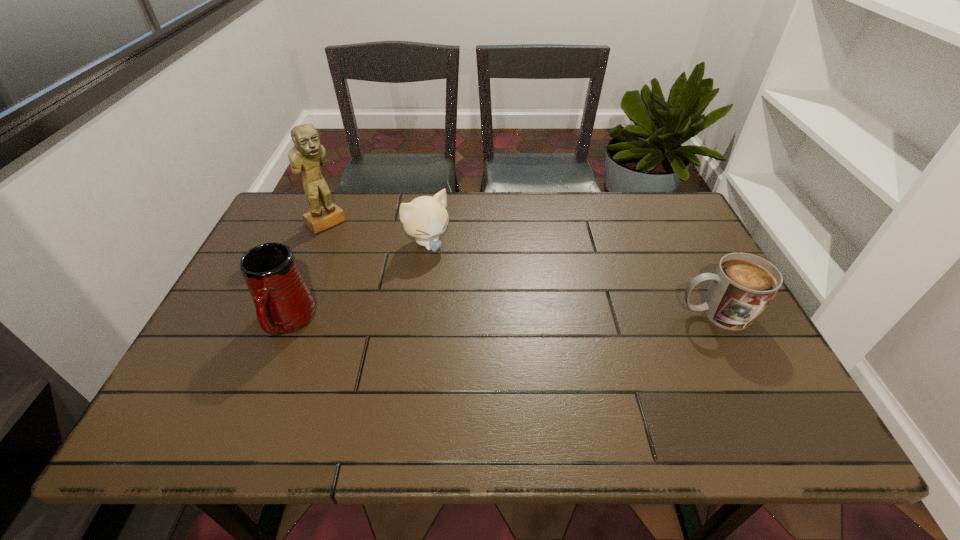
Find the location of a particular element. This screenshot has height=540, width=960. the taller mug is located at coordinates (284, 303).

Locate an element on the screen. the right mug is located at coordinates [742, 286].

This screenshot has width=960, height=540. Identify the location of the rightmost object. (742, 286).

What are the coordinates of `the second object from right to left` in the screenshot? It's located at (425, 218).

This screenshot has width=960, height=540. I want to click on the tallest object, so click(307, 154).

What are the coordinates of `free region located on the side of the taller mug with the handle` in the screenshot? It's located at (262, 386).

This screenshot has width=960, height=540. Identify the location of vacant space located 0.360m on the side of the rightmost object with the handle. (531, 314).

Locate an element on the screen. The height and width of the screenshot is (540, 960). blank space located 0.190m on the side of the rightmost object with the handle is located at coordinates (600, 314).

At what (x,y) coordinates should I click in order to perform the action: click on free space located on the side of the rightmost object with the handle. Please return your answer as a coordinate pair (x, y). The image size is (960, 540). Looking at the image, I should click on (567, 314).

I want to click on free space located on the face of the kitten, so click(x=514, y=341).